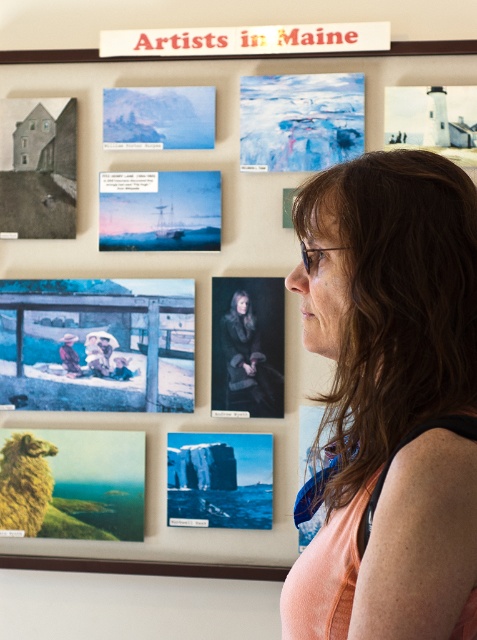
You are standing in front of the wall of artworks and want to take a photo of the point at coordinates point (133, 449). Your camera has a focal length of 50mm and you are 9.00 feet away from the point. What is the angle of view required to capture the entire point in your photo?

The point at coordinates point (133, 449) is 9.00 feet away from the camera. To calculate the angle of view required, use the formula angle of view equals the arctangent of the sensor size divided by twice the distance. However, since the point is a single coordinate, the angle of view needed would be very small, likely within the camera lens capabilities.

You are an art curator examining the wall of artworks. There are two points marked on the wall at coordinates point (249, 97) and point (110, 176). Which point is closer to your current position as you stand in front of the wall?

Point (249, 97) is closer to the viewer than point (110, 176), so the point (249, 97) is closer to your current position.

You are an art collector examining the wall of artwork. You see the fluffy wool sheep at lower left and the matte paper house at left. Which object is positioned to the right of the other?

The fluffy wool sheep at lower left is positioned to the right of the matte paper house at left.